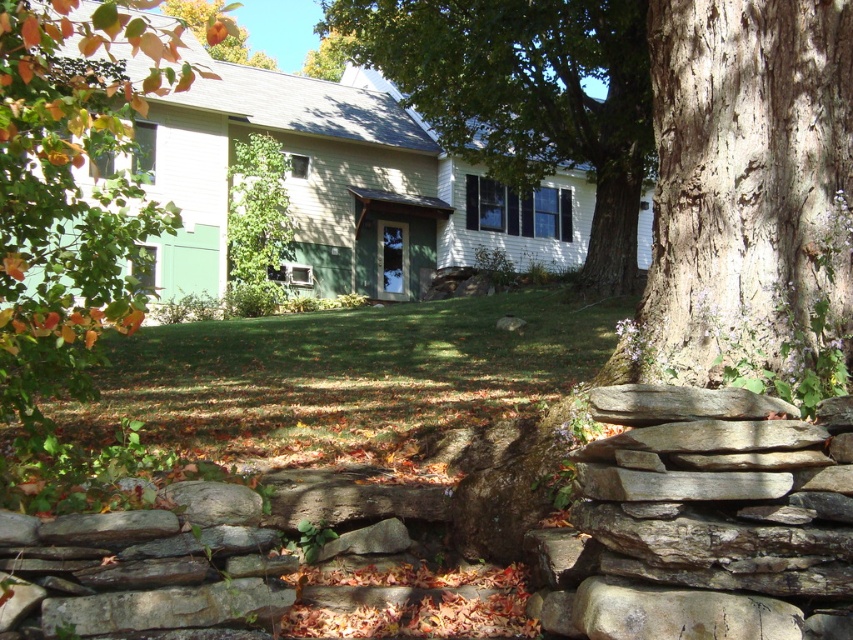
You are standing in front of the house and want to take a photo of both the green leafy tree at left and the green leafy tree at upper center. Which tree should you position yourself closer to in order to include both in your camera frame without moving the camera?

You should position yourself closer to the green leafy tree at left because it is located below the green leafy tree at upper center, so by moving closer to the lower one, both trees can be captured in the frame.

In the scene shown: You are standing at the entrance of the house and want to walk to the point marked as point (265, 193). Which direction should you move relative to point (114, 26)?

You should move away from point (114, 26) because point (265, 193) is behind it.

You are standing at the entrance of the house and want to walk towards the point marked as point (47, 67). Which direction should you go relative to the other point, point (323, 65)?

You should walk towards the point (47, 67), which is in front of point (323, 65). This means the direction is towards the viewer compared to the other point.